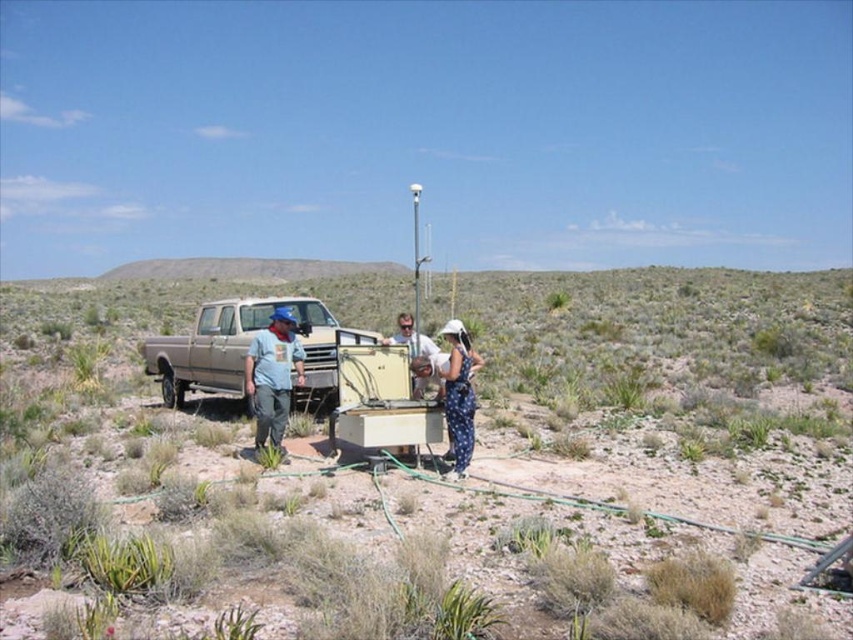
Does brown matte truck at center appear on the right side of blue dotted dress at center?

No, brown matte truck at center is not to the right of blue dotted dress at center.

Is brown matte truck at center thinner than blue dotted dress at center?

Incorrect, brown matte truck at center's width is not less than blue dotted dress at center's.

At what (x,y) coordinates should I click in order to perform the action: click on brown matte truck at center. Please return your answer as a coordinate pair (x, y). Looking at the image, I should click on (242, 348).

Is dirt field at center thinner than matte blue shirt at center?

Incorrect, dirt field at center's width is not less than matte blue shirt at center's.

Does dirt field at center lie in front of matte blue shirt at center?

Yes.

What do you see at coordinates (486, 456) in the screenshot?
I see `dirt field at center` at bounding box center [486, 456].

Find the location of a particular element. dirt field at center is located at coordinates (486, 456).

Does point (24, 291) come farther from viewer compared to point (323, 397)?

Yes, it is.

Is dirt field at center bigger than brown matte truck at center?

Indeed, dirt field at center has a larger size compared to brown matte truck at center.

This screenshot has height=640, width=853. Describe the element at coordinates (486, 456) in the screenshot. I see `dirt field at center` at that location.

Where is `dirt field at center`? The height and width of the screenshot is (640, 853). dirt field at center is located at coordinates (486, 456).